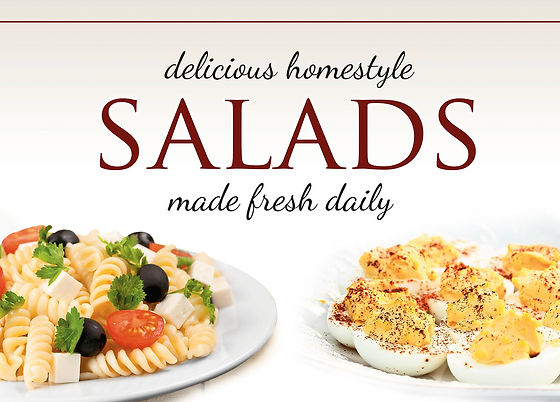
At what (x,y) coordinates should I click in order to perform the action: click on plates. Please return your answer as a coordinate pair (x, y). Image resolution: width=560 pixels, height=402 pixels. Looking at the image, I should click on (241, 288), (238, 347), (136, 393), (320, 288), (322, 336), (438, 385).